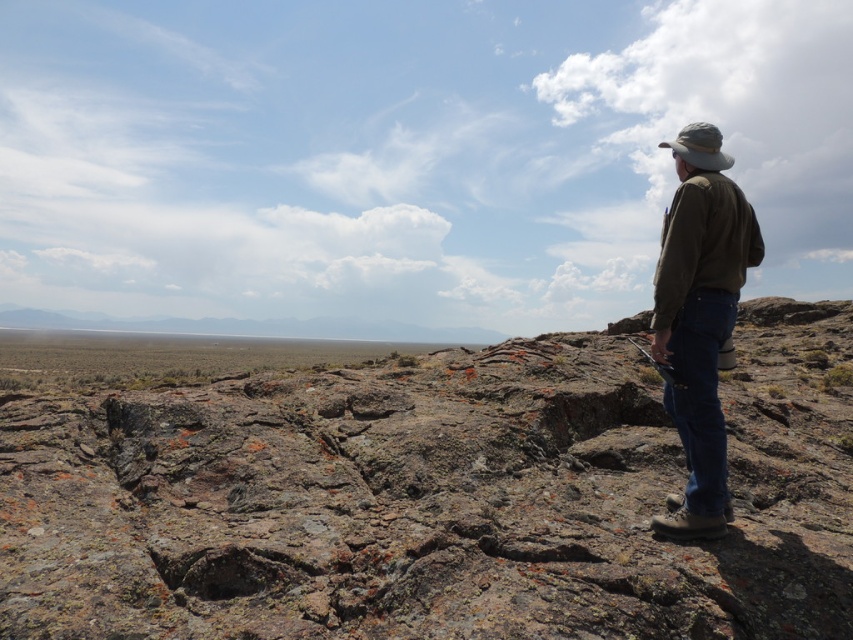
You are a photographer standing in the rugged, rocky foreground of the landscape. You want to capture both the point at coordinates point [71,358] and the point at coordinates point [714,465] in your shot. Which point should you focus on first to ensure both are in focus?

You should focus on point [71,358] first because it is closer to you than point [714,465]. By focusing on the closer point, the farther point will also be within the depth of field, ensuring both are in focus.